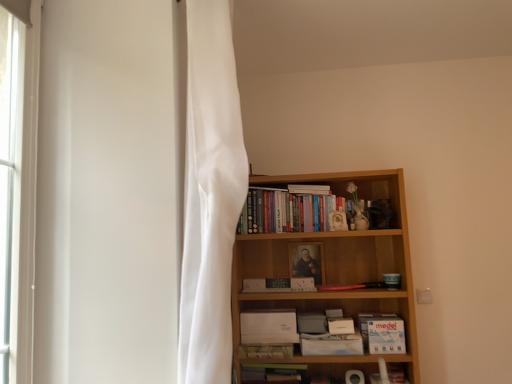
Question: Considering the positions of white matte paperback book at lower center, placed as the 5th paperback book when sorted from right to left, and white matte paperback book at lower right, the 5th paperback book from the left, in the image, is white matte paperback book at lower center, placed as the 5th paperback book when sorted from right to left, taller or shorter than white matte paperback book at lower right, the 5th paperback book from the left,?

Choices:
 (A) short
 (B) tall

Answer: (B)

Question: From the image's perspective, is white matte paperback book at lower center, which is the 2th paperback book in left-to-right order, located above or below white matte paperback book at lower right, the 5th paperback book from the left?

Choices:
 (A) below
 (B) above

Answer: (A)

Question: Which of these objects is positioned closest to the white matte paperback book at lower right, the 6th paperback book viewed from the left?

Choices:
 (A) white paper book at upper center, placed as the 1th book when sorted from top to bottom
 (B) green matte paperback book at lower center, which appears as the 6th paperback book when viewed from the right
 (C) white sheer curtain at left
 (D) white sheer curtain at left
 (E) matte white paperback book at center, placed as the 3th paperback book when sorted from left to right

Answer: (E)

Question: Which of these objects is positioned farthest from the white matte paperback book at lower center, the 4th paperback book from the left?

Choices:
 (A) matte white paperback book at center, placed as the 3th paperback book when sorted from left to right
 (B) wooden bookcase at center
 (C) white sheer curtain at left
 (D) green matte paperback book at lower center, which appears as the 6th paperback book when viewed from the right
 (E) white paper book at upper center, placed as the 1th book when sorted from top to bottom

Answer: (C)